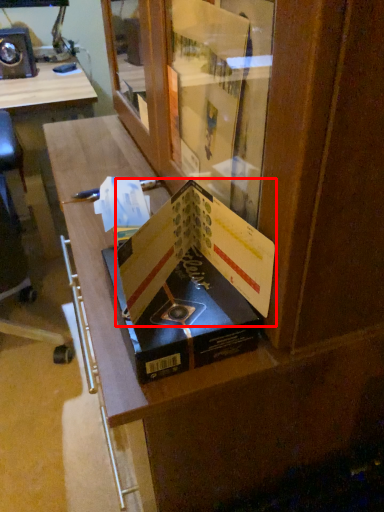
Question: Observing the image, what is the correct spatial positioning of paperback book (annotated by the red box) in reference to paperback book?

Choices:
 (A) right
 (B) left

Answer: (A)